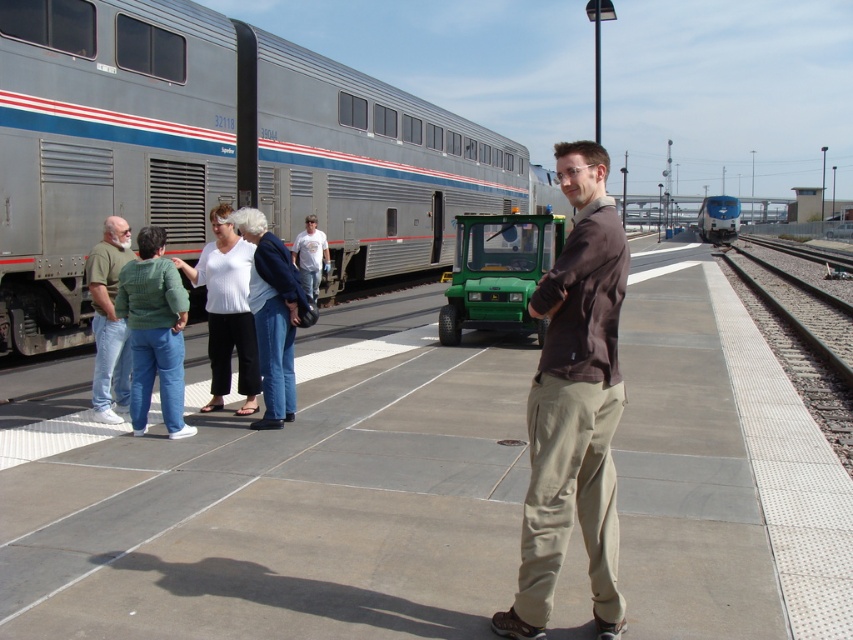
You are a person standing on the platform and want to walk from one end to the other without stepping off the platform. Considering the concrete platform at center and the brown cotton shirt at center, which object determines the maximum width you can walk within?

The concrete platform at center determines the maximum width you can walk within because its width surpasses that of the brown cotton shirt at center.